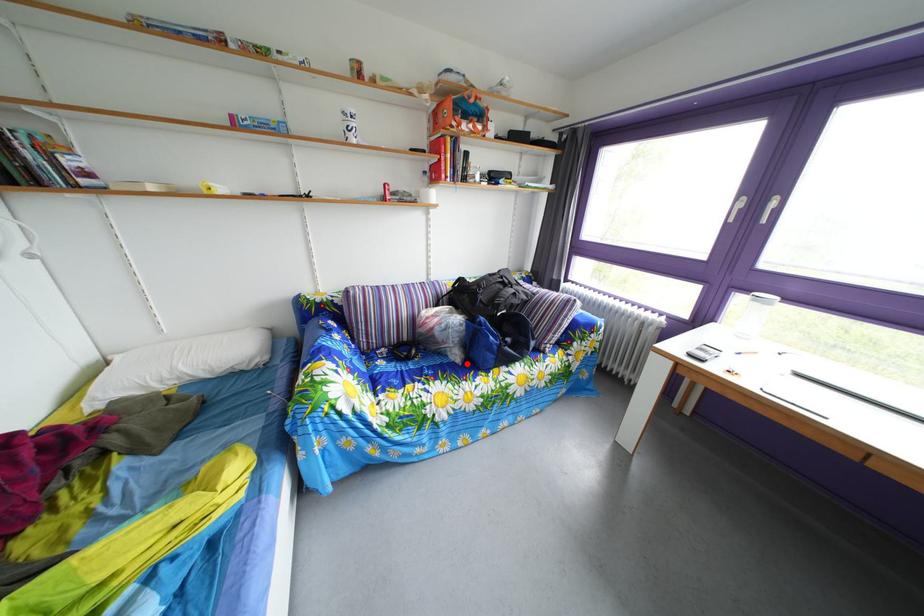
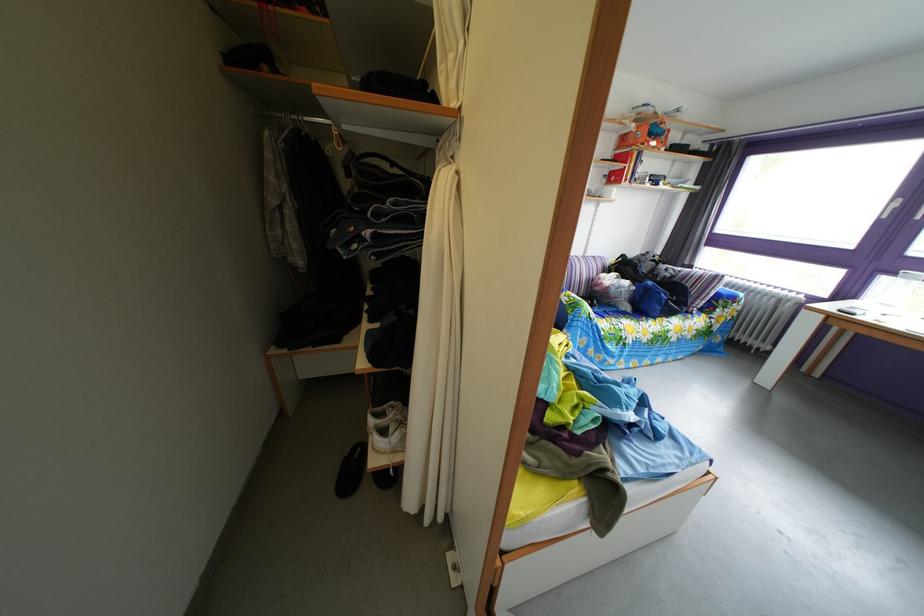
Find the pixel in the second image that matches the highlighted location in the first image.

(638, 315)